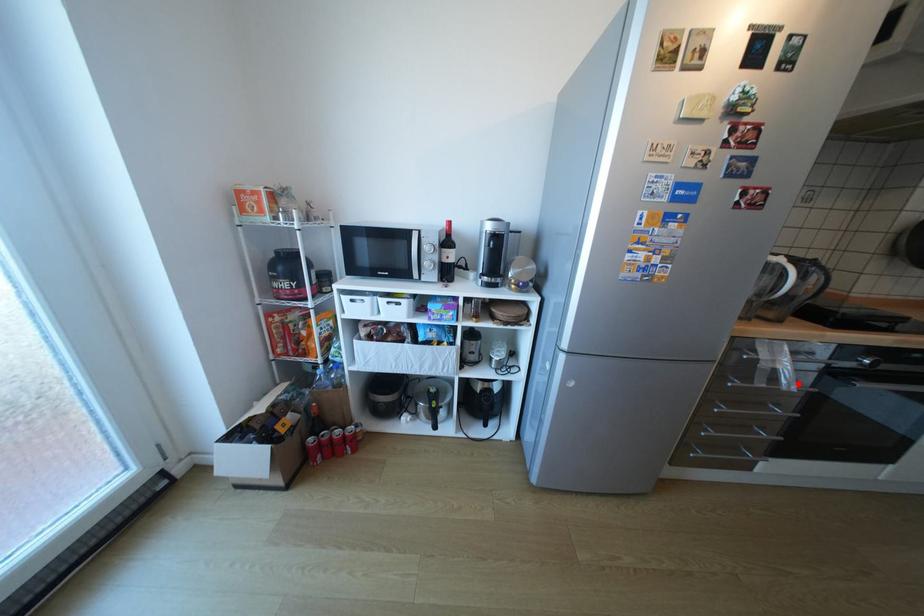
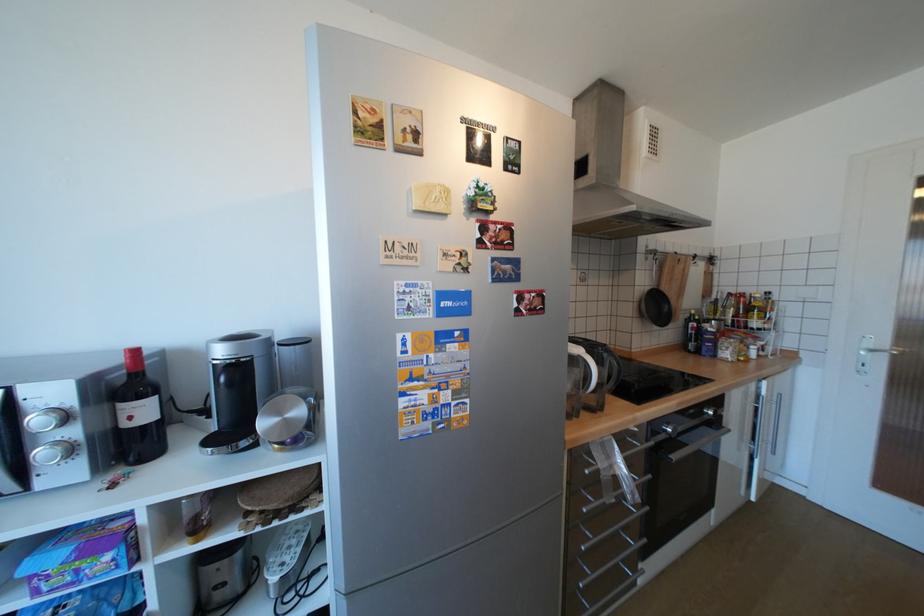
Question: I am providing you with two images of the same scene from different viewpoints. In image1, a red point is highlighted. Considering the same 3D point in image2, which of the following is correct?

Choices:
 (A) It is closer
 (B) It is farther

Answer: (B)